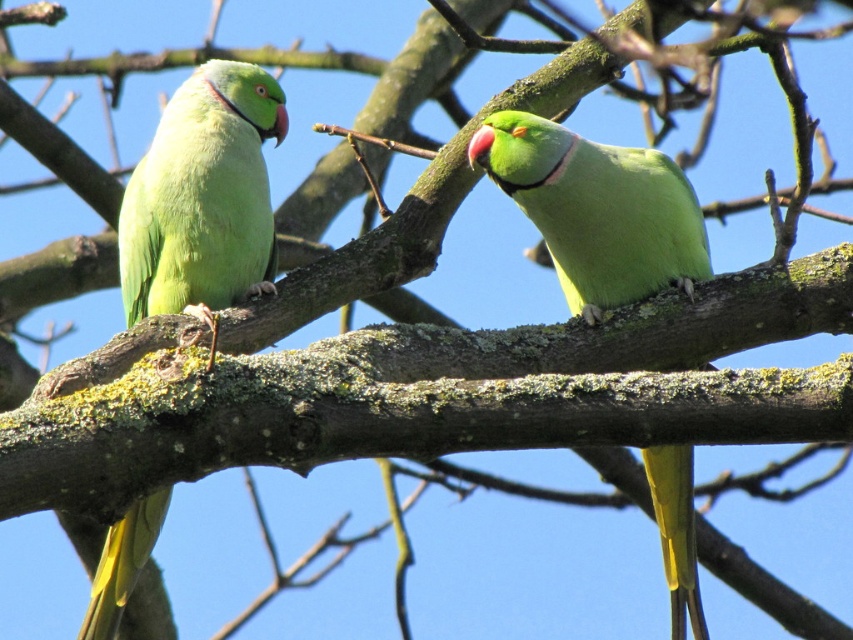
Question: Which point is closer to the camera?

Choices:
 (A) matte green parrot at left
 (B) green matte parrot at center

Answer: (A)

Question: Where is matte green parrot at left located in relation to green matte parrot at center in the image?

Choices:
 (A) right
 (B) left

Answer: (B)

Question: Which of the following is the closest to the observer?

Choices:
 (A) tap(663, 214)
 (B) tap(265, 122)

Answer: (A)

Question: From the image, what is the correct spatial relationship of matte green parrot at left in relation to green matte parrot at center?

Choices:
 (A) above
 (B) below

Answer: (A)

Question: Is matte green parrot at left to the left of green matte parrot at center from the viewer's perspective?

Choices:
 (A) yes
 (B) no

Answer: (A)

Question: Which of the following is the closest to the observer?

Choices:
 (A) (544, 154)
 (B) (190, 305)

Answer: (A)